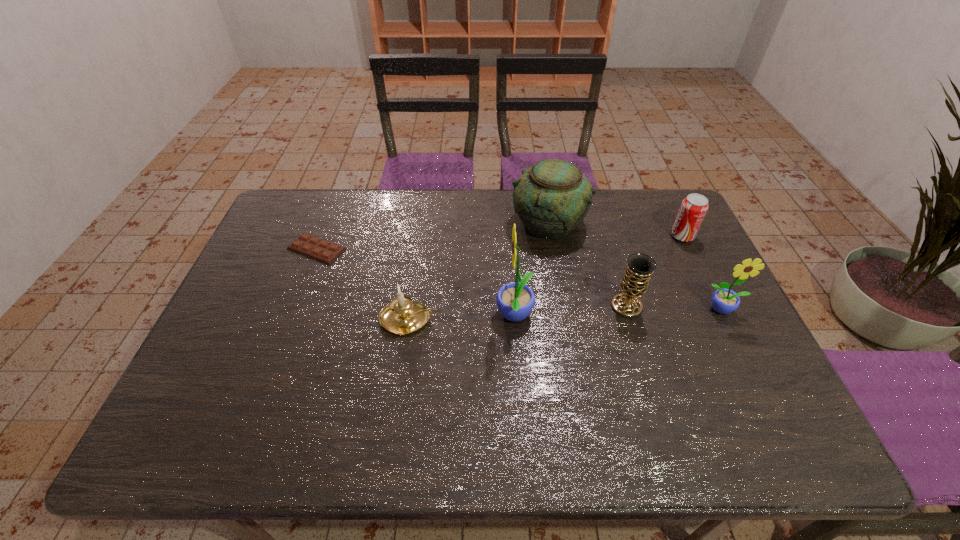
At what (x,y) coordinates should I click in order to perform the action: click on vacant spot to place a sunflower on the left. Please return your answer as a coordinate pair (x, y). The height and width of the screenshot is (540, 960). Looking at the image, I should click on (300, 324).